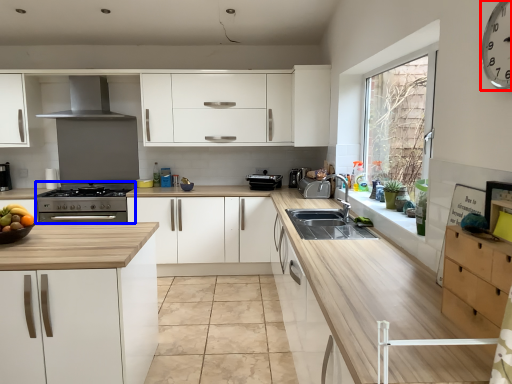
Question: Which point is further to the camera, clock (highlighted by a red box) or appliance (highlighted by a blue box)?

Choices:
 (A) clock
 (B) appliance

Answer: (B)